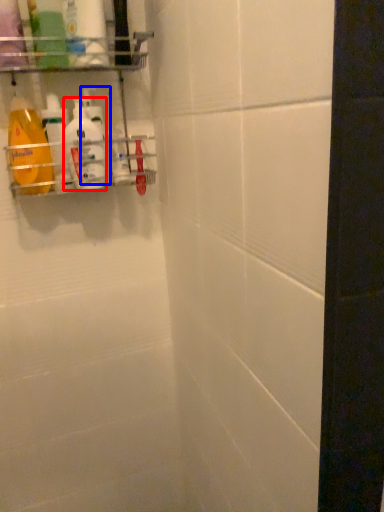
Question: Which point is further to the camera, cleaning product (highlighted by a red box) or cleaning product (highlighted by a blue box)?

Choices:
 (A) cleaning product
 (B) cleaning product

Answer: (B)